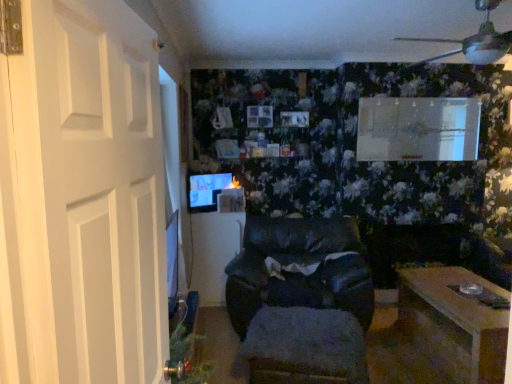
Identify the location of wooden coffee table at center, the 1th table viewed from the back. (214, 252).

What is the approximate width of black leather chair at center?

It is 3.39 feet.

Where is `fuzzy fabric footrest at center`? fuzzy fabric footrest at center is located at coordinates (305, 347).

Describe the element at coordinates (83, 198) in the screenshot. Image resolution: width=512 pixels, height=384 pixels. I see `white matte door at left` at that location.

This screenshot has width=512, height=384. Identify the location of wooden coffee table at center, which is the 2th table from front to back. (214, 252).

Is black leather chair at center thinner than white matte door at left?

In fact, black leather chair at center might be wider than white matte door at left.

Does black leather chair at center come in front of white matte door at left?

No, black leather chair at center is further to the viewer.

Between black leather chair at center and white matte door at left, which one has more height?

white matte door at left is taller.

Considering the positions of point (361, 297) and point (109, 222), is point (361, 297) closer or farther from the camera than point (109, 222)?

Point (361, 297).

Considering the sizes of wooden table at lower right, which appears as the second table when viewed from the left, and white matte door at left in the image, is wooden table at lower right, which appears as the second table when viewed from the left, bigger or smaller than white matte door at left?

In the image, wooden table at lower right, which appears as the second table when viewed from the left, appears to be larger than white matte door at left.

How different are the orientations of wooden table at lower right, which appears as the second table when viewed from the left, and white matte door at left in degrees?

The angular difference between wooden table at lower right, which appears as the second table when viewed from the left, and white matte door at left is 84.8 degrees.

Could you measure the distance between wooden table at lower right, the 1th table in the front-to-back sequence, and white matte door at left?

wooden table at lower right, the 1th table in the front-to-back sequence, and white matte door at left are 7.67 feet apart.

From the image's perspective, is wooden table at lower right, which ranks as the second table in back-to-front order, on top of white matte door at left?

No, from the image's perspective, wooden table at lower right, which ranks as the second table in back-to-front order, is not on top of white matte door at left.

From the image's perspective, is white matte door at left above fuzzy fabric footrest at center?

Yes, from the image's perspective, white matte door at left is over fuzzy fabric footrest at center.

Is there a large distance between white matte door at left and fuzzy fabric footrest at center?

white matte door at left is positioned a significant distance from fuzzy fabric footrest at center.

In order to click on footrest behind the white matte door at left in this screenshot , I will do `click(305, 347)`.

Is white matte door at left situated inside fuzzy fabric footrest at center or outside?

white matte door at left is not inside fuzzy fabric footrest at center, it's outside.

Could you tell me if white matte door at left is turned towards wooden coffee table at center, the 1th table viewed from the back?

No.

From the image's perspective, does white matte door at left appear lower than wooden coffee table at center, positioned as the 2th table in right-to-left order?

No.

Locate an element on the screen. The width and height of the screenshot is (512, 384). door above the wooden coffee table at center, the 1th table positioned from the left (from a real-world perspective) is located at coordinates (83, 198).

I want to click on table above the wooden table at lower right, the 1th table viewed from the right (from a real-world perspective), so click(x=214, y=252).

Considering the relative positions of wooden coffee table at center, positioned as the 2th table in right-to-left order, and wooden table at lower right, the 1th table in the front-to-back sequence, in the image provided, is wooden coffee table at center, positioned as the 2th table in right-to-left order, behind wooden table at lower right, the 1th table in the front-to-back sequence,?

Yes, wooden coffee table at center, positioned as the 2th table in right-to-left order, is further from the camera.

From a real-world perspective, which object rests below the other?

In real-world perspective, wooden table at lower right, the 1th table in the front-to-back sequence, is lower.

From a real-world perspective, is black leather chair at center over fuzzy fabric footrest at center?

Correct, in the physical world, black leather chair at center is higher than fuzzy fabric footrest at center.

Can you confirm if black leather chair at center is positioned to the right of fuzzy fabric footrest at center?

Yes, black leather chair at center is to the right of fuzzy fabric footrest at center.

Considering the relative sizes of black leather chair at center and fuzzy fabric footrest at center in the image provided, is black leather chair at center smaller than fuzzy fabric footrest at center?

No, black leather chair at center is not smaller than fuzzy fabric footrest at center.

Could you tell me if fuzzy fabric footrest at center is turned towards matte black monitor at center?

No, fuzzy fabric footrest at center is not facing towards matte black monitor at center.

In the scene shown: From a real-world perspective, which object stands above the other?

matte black monitor at center is physically above.

Is matte black monitor at center surrounded by fuzzy fabric footrest at center?

Definitely not — matte black monitor at center is not inside fuzzy fabric footrest at center.

Considering the relative sizes of fuzzy fabric footrest at center and matte black monitor at center in the image provided, is fuzzy fabric footrest at center smaller than matte black monitor at center?

Actually, fuzzy fabric footrest at center might be larger than matte black monitor at center.

Locate an element on the screen. This screenshot has width=512, height=384. door lying on the left of black leather chair at center is located at coordinates (83, 198).

From a real-world perspective, count 2nd tables downward from the white matte door at left and point to it. Please provide its 2D coordinates.

[(455, 323)]

Based on their spatial positions, is wooden table at lower right, which ranks as the second table in back-to-front order, or black leather chair at center further from white matte door at left?

wooden table at lower right, which ranks as the second table in back-to-front order, is further to white matte door at left.

When comparing their distances from wooden coffee table at center, the 1th table positioned from the left, does fuzzy fabric footrest at center or matte black monitor at center seem further?

fuzzy fabric footrest at center is positioned further to the anchor wooden coffee table at center, the 1th table positioned from the left.

Considering their positions, is white matte door at left positioned further to fuzzy fabric footrest at center than wooden table at lower right, the 1th table in the front-to-back sequence?

The object further to fuzzy fabric footrest at center is white matte door at left.

Considering their positions, is fuzzy fabric footrest at center positioned further to white matte door at left than black leather chair at center?

black leather chair at center.

From the image, which object appears to be nearer to matte black monitor at center, white matte door at left or wooden table at lower right, which ranks as the second table in back-to-front order?

wooden table at lower right, which ranks as the second table in back-to-front order, is positioned closer to the anchor matte black monitor at center.

When comparing their distances from wooden table at lower right, the 1th table in the front-to-back sequence, does matte black monitor at center or black leather chair at center seem further?

matte black monitor at center.

Which object lies nearer to the anchor point wooden coffee table at center, the 1th table positioned from the left, black leather chair at center or fuzzy fabric footrest at center?

black leather chair at center is positioned closer to the anchor wooden coffee table at center, the 1th table positioned from the left.

In the scene shown: Based on their spatial positions, is wooden table at lower right, the 1th table in the front-to-back sequence, or matte black monitor at center further from wooden coffee table at center, which is the 2th table from front to back?

wooden table at lower right, the 1th table in the front-to-back sequence, is further to wooden coffee table at center, which is the 2th table from front to back.

The width and height of the screenshot is (512, 384). What are the coordinates of `computer monitor positioned between white matte door at left and wooden coffee table at center, the 1th table viewed from the back, from near to far` in the screenshot? It's located at (207, 190).

The height and width of the screenshot is (384, 512). Identify the location of table between white matte door at left and black leather chair at center along the z-axis. (455, 323).

Where is `computer monitor between fuzzy fabric footrest at center and wooden coffee table at center, the 1th table positioned from the left, from front to back`? The width and height of the screenshot is (512, 384). computer monitor between fuzzy fabric footrest at center and wooden coffee table at center, the 1th table positioned from the left, from front to back is located at coordinates (207, 190).

Find the location of `computer monitor between black leather chair at center and wooden coffee table at center, the 1th table positioned from the left, from front to back`. computer monitor between black leather chair at center and wooden coffee table at center, the 1th table positioned from the left, from front to back is located at coordinates (207, 190).